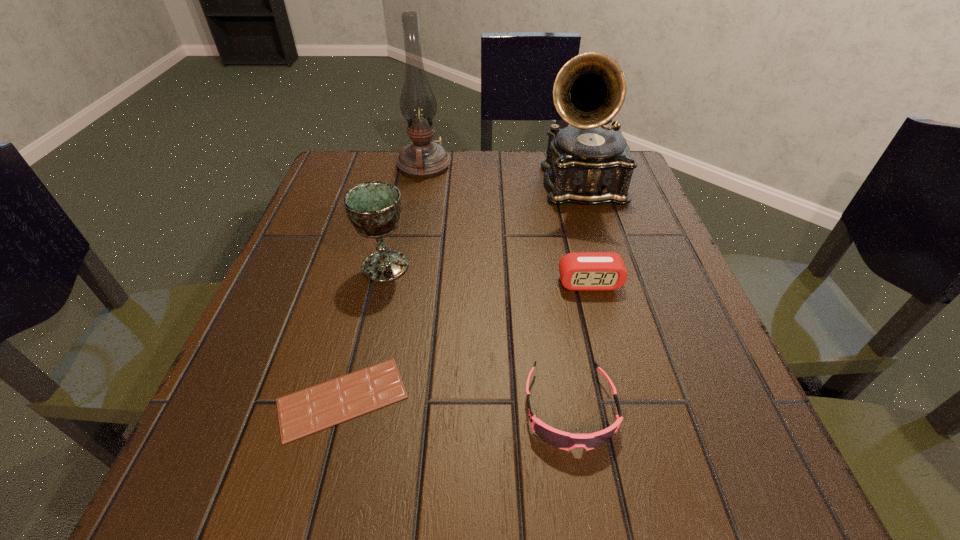
You are a GUI agent. You are given a task and a screenshot of the screen. Output one action in this format:
    pyautogui.click(x=<x>, y=<y>)
    Task: Click on the empty space between the chocolate bar and the chalice
    
    Given the screenshot: What is the action you would take?
    pyautogui.click(x=364, y=332)

Find the location of `free space between the phonograph record and the alarm clock`. free space between the phonograph record and the alarm clock is located at coordinates (585, 234).

Locate an element on the screen. This screenshot has height=540, width=960. vacant region between the oil lamp and the phonograph record is located at coordinates (502, 175).

Where is `free space between the alarm clock and the chalice`? This screenshot has width=960, height=540. free space between the alarm clock and the chalice is located at coordinates (488, 274).

The height and width of the screenshot is (540, 960). In order to click on unoccupied position between the third shortest object and the phonograph record in this screenshot , I will do `click(585, 234)`.

The height and width of the screenshot is (540, 960). I want to click on free space between the fifth tallest object and the oil lamp, so click(497, 287).

You are a GUI agent. You are given a task and a screenshot of the screen. Output one action in this format:
    pyautogui.click(x=<x>, y=<y>)
    Task: Click on the unoccupied area between the shortest object and the goggles
    The height and width of the screenshot is (540, 960).
    Given the screenshot: What is the action you would take?
    pyautogui.click(x=456, y=403)

Find the location of a particular element. empty space between the fifth tallest object and the third shortest object is located at coordinates [x=580, y=346].

This screenshot has height=540, width=960. What are the coordinates of `object that stands as the fifth closest to the goggles` in the screenshot? It's located at (423, 158).

The width and height of the screenshot is (960, 540). I want to click on object that stands as the third closest to the oil lamp, so click(x=581, y=270).